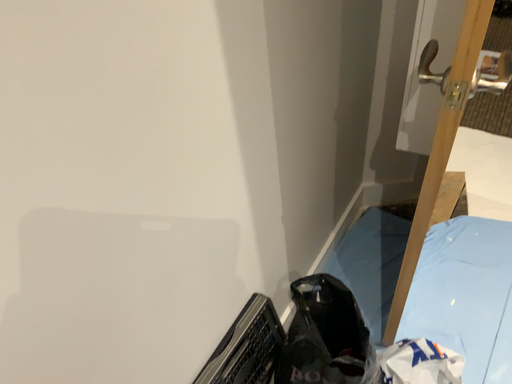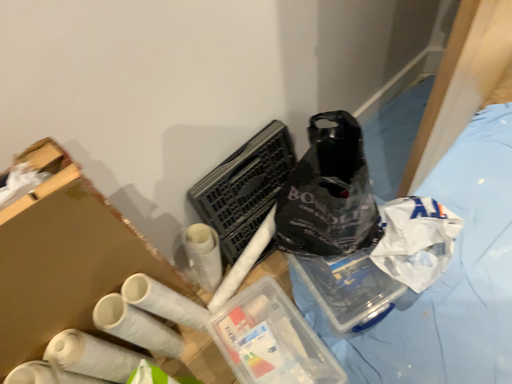
Question: How did the camera likely rotate when shooting the video?

Choices:
 (A) rotated upward
 (B) rotated downward

Answer: (B)